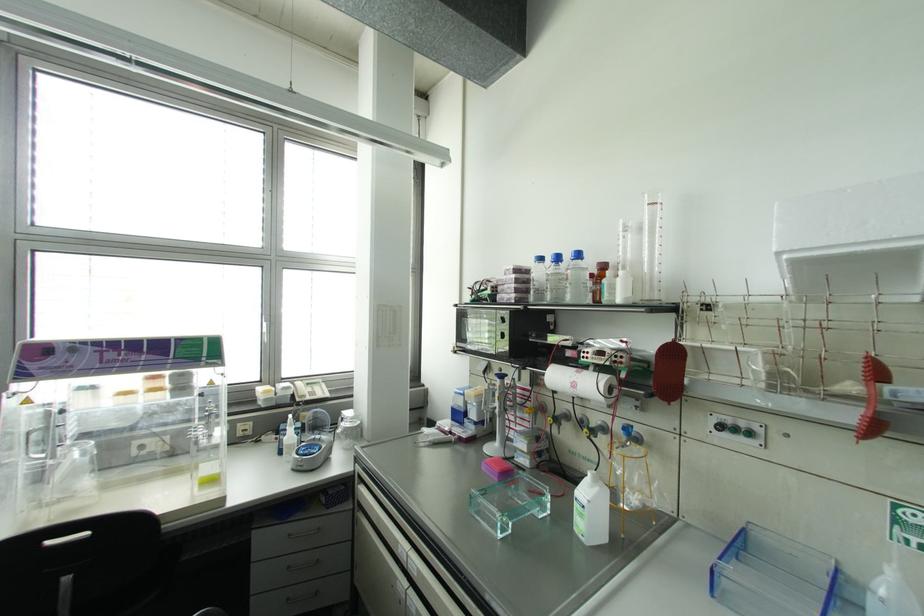
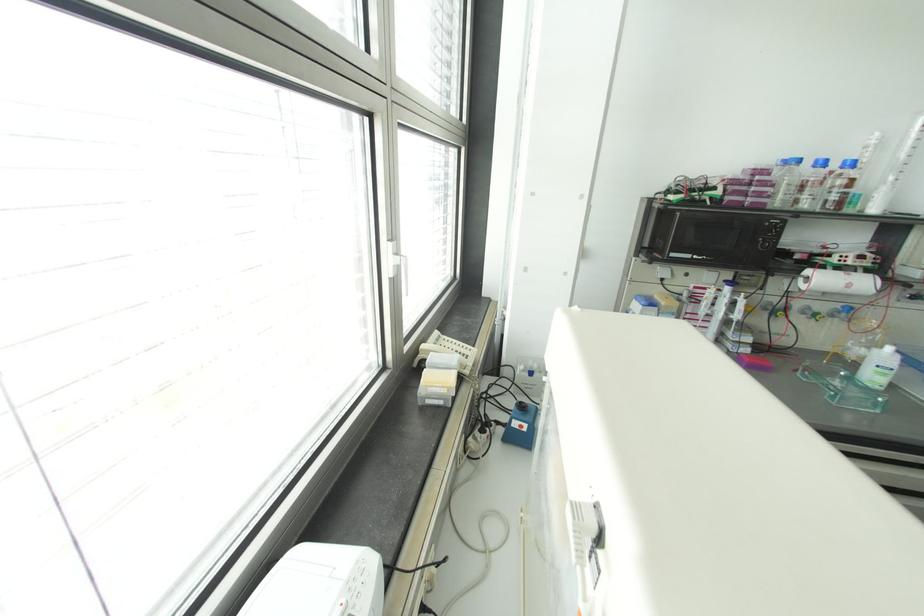
In the second image, find the point that corresponds to (556,257) in the first image.

(822, 163)